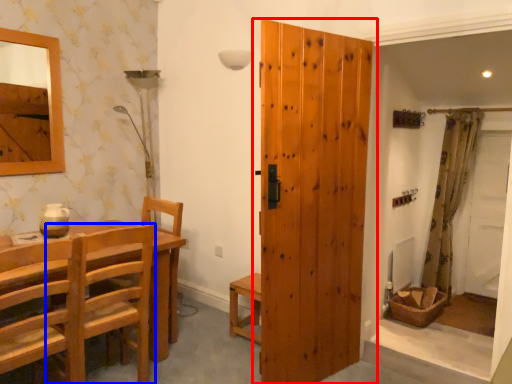
Question: Which object appears farthest to the camera in this image, door (highlighted by a red box) or chair (highlighted by a blue box)?

Choices:
 (A) door
 (B) chair

Answer: (A)